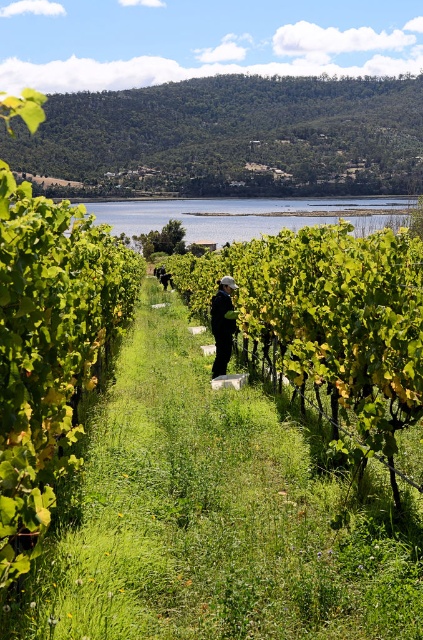
Is clear water at center wider than dark green fabric at center?

Indeed, clear water at center has a greater width compared to dark green fabric at center.

Does clear water at center have a lesser width compared to dark green fabric at center?

Incorrect, clear water at center's width is not less than dark green fabric at center's.

Find the location of a particular element. Image resolution: width=423 pixels, height=640 pixels. clear water at center is located at coordinates (249, 216).

Image resolution: width=423 pixels, height=640 pixels. What are the coordinates of `clear water at center` in the screenshot? It's located at (249, 216).

Between green leafy vine at center and dark green fabric at center, which one is positioned lower?

dark green fabric at center is lower down.

Which is behind, point (335, 435) or point (220, 278)?

The point (220, 278) is behind.

The height and width of the screenshot is (640, 423). I want to click on green leafy vine at center, so click(329, 321).

Does green leafy vine at center lie behind clear water at center?

No, it is not.

How much distance is there between green leafy vine at center and clear water at center?

The distance of green leafy vine at center from clear water at center is 93.54 feet.

Between point (346, 296) and point (353, 208), which one is positioned in front?

Positioned in front is point (346, 296).

I want to click on green leafy vine at center, so click(329, 321).